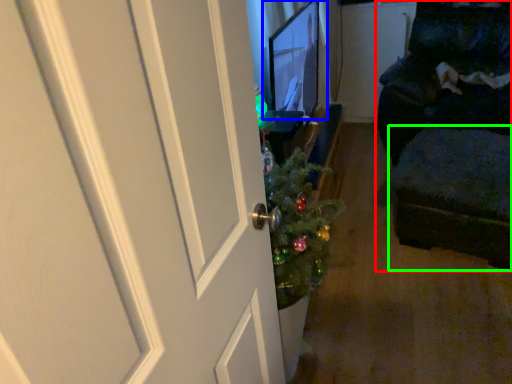
Question: Estimate the real-world distances between objects in this image. Which object is farther from furniture (highlighted by a red box), computer monitor (highlighted by a blue box) or footrest (highlighted by a green box)?

Choices:
 (A) computer monitor
 (B) footrest

Answer: (A)